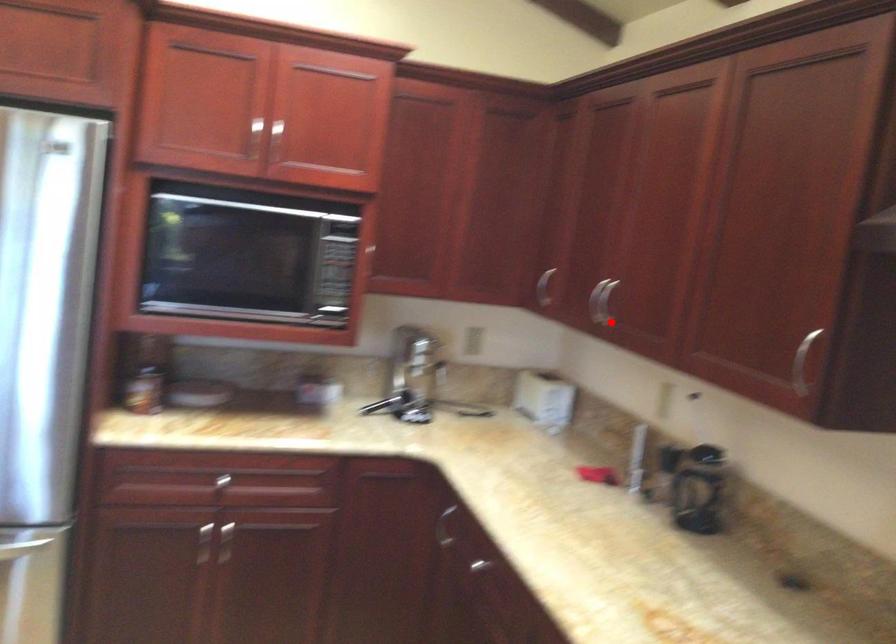
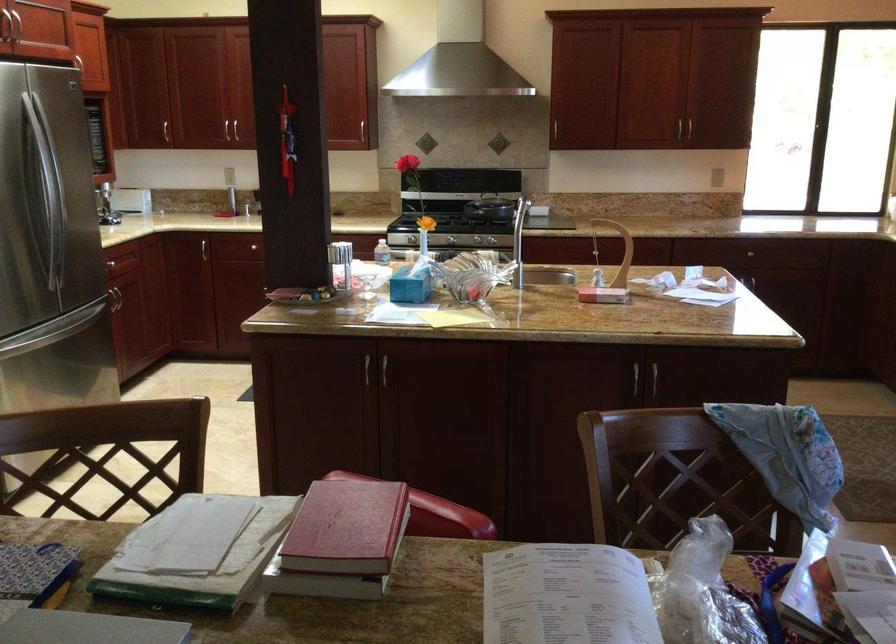
Question: I am providing you with two images of the same scene from different viewpoints. A red point is shown in image1. For the corresponding object point in image2, is it positioned nearer or farther from the camera?

Choices:
 (A) Nearer
 (B) Farther

Answer: (B)